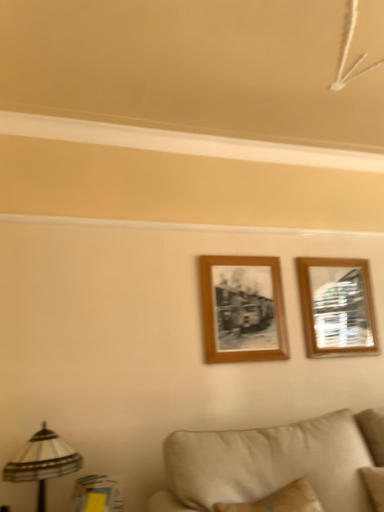
Question: Should I look upward or downward to see striped fabric lampshade at lower left?

Choices:
 (A) down
 (B) up

Answer: (A)

Question: Considering the relative positions of beige fabric couch at lower center and wooden picture frame at upper right, marked as the first picture frame in a right-to-left arrangement, in the image provided, is beige fabric couch at lower center to the left of wooden picture frame at upper right, marked as the first picture frame in a right-to-left arrangement, from the viewer's perspective?

Choices:
 (A) yes
 (B) no

Answer: (A)

Question: Is beige fabric couch at lower center shorter than wooden picture frame at upper right, marked as the 2th picture frame in a left-to-right arrangement?

Choices:
 (A) no
 (B) yes

Answer: (B)

Question: Considering the relative positions of beige fabric couch at lower center and wooden picture frame at upper right, marked as the 2th picture frame in a left-to-right arrangement, in the image provided, is beige fabric couch at lower center in front of wooden picture frame at upper right, marked as the 2th picture frame in a left-to-right arrangement,?

Choices:
 (A) yes
 (B) no

Answer: (A)

Question: Does beige fabric couch at lower center turn towards wooden picture frame at upper right, marked as the first picture frame in a right-to-left arrangement?

Choices:
 (A) no
 (B) yes

Answer: (A)

Question: From the image's perspective, is beige fabric couch at lower center located above wooden picture frame at upper right, marked as the 2th picture frame in a left-to-right arrangement?

Choices:
 (A) yes
 (B) no

Answer: (B)

Question: Are beige fabric couch at lower center and wooden picture frame at upper right, marked as the 2th picture frame in a left-to-right arrangement, far apart?

Choices:
 (A) no
 (B) yes

Answer: (A)

Question: From a real-world perspective, is wooden picture frame at upper right, marked as the 2th picture frame in a left-to-right arrangement, over striped fabric lampshade at lower left?

Choices:
 (A) no
 (B) yes

Answer: (B)

Question: Is wooden picture frame at upper right, marked as the 2th picture frame in a left-to-right arrangement, to the right of striped fabric lampshade at lower left from the viewer's perspective?

Choices:
 (A) yes
 (B) no

Answer: (A)

Question: Does wooden picture frame at upper right, marked as the 2th picture frame in a left-to-right arrangement, have a greater height compared to striped fabric lampshade at lower left?

Choices:
 (A) no
 (B) yes

Answer: (B)

Question: Can you confirm if wooden picture frame at upper right, marked as the first picture frame in a right-to-left arrangement, is bigger than striped fabric lampshade at lower left?

Choices:
 (A) no
 (B) yes

Answer: (A)

Question: Is wooden picture frame at upper right, marked as the first picture frame in a right-to-left arrangement, further to the viewer compared to striped fabric lampshade at lower left?

Choices:
 (A) no
 (B) yes

Answer: (B)

Question: Does wooden picture frame at upper right, marked as the 2th picture frame in a left-to-right arrangement, come in front of striped fabric lampshade at lower left?

Choices:
 (A) yes
 (B) no

Answer: (B)

Question: From the image's perspective, would you say wooden photo frame at center, placed as the 1th picture frame when sorted from left to right, is shown under beige fabric couch at lower center?

Choices:
 (A) yes
 (B) no

Answer: (B)